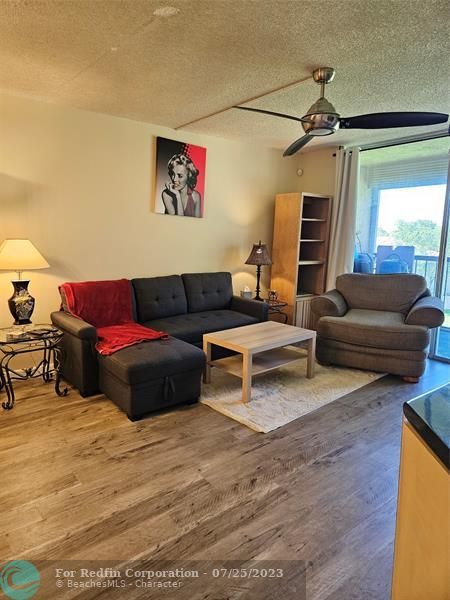
Locate an element on the screen. The width and height of the screenshot is (450, 600). chair is located at coordinates (369, 336).